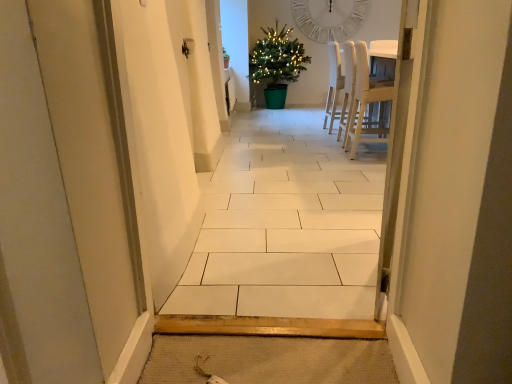
Question: From the image's perspective, is white wood chair at center, which is counted as the second chair, starting from the front, on top of white tile floor at center?

Choices:
 (A) no
 (B) yes

Answer: (B)

Question: Is white wood chair at center, which is counted as the second chair, starting from the front, thinner than white tile floor at center?

Choices:
 (A) no
 (B) yes

Answer: (A)

Question: Considering the relative positions of white wood chair at center, which is the first chair from back to front, and white tile floor at center in the image provided, is white wood chair at center, which is the first chair from back to front, behind white tile floor at center?

Choices:
 (A) yes
 (B) no

Answer: (A)

Question: Can you confirm if white wood chair at center, which is the first chair from back to front, is positioned to the left of white tile floor at center?

Choices:
 (A) no
 (B) yes

Answer: (A)

Question: From the image's perspective, is white wood chair at center, which is the first chair from back to front, below white tile floor at center?

Choices:
 (A) yes
 (B) no

Answer: (B)

Question: From a real-world perspective, is white wood chair at center, which is the first chair from back to front, on top of white tile floor at center?

Choices:
 (A) yes
 (B) no

Answer: (B)

Question: Considering the relative positions of white wood chair at center, which is the first chair from back to front, and white matte clock at upper center in the image provided, is white wood chair at center, which is the first chair from back to front, to the left of white matte clock at upper center from the viewer's perspective?

Choices:
 (A) yes
 (B) no

Answer: (A)

Question: Can you confirm if white wood chair at center, which is the first chair from back to front, is smaller than white matte clock at upper center?

Choices:
 (A) yes
 (B) no

Answer: (B)

Question: From a real-world perspective, does white wood chair at center, which is the first chair from back to front, stand above white matte clock at upper center?

Choices:
 (A) yes
 (B) no

Answer: (B)

Question: Does white wood chair at center, which is counted as the second chair, starting from the front, lie in front of white matte clock at upper center?

Choices:
 (A) no
 (B) yes

Answer: (B)

Question: Is white matte clock at upper center at the back of white wood chair at center, which is counted as the second chair, starting from the front?

Choices:
 (A) no
 (B) yes

Answer: (A)

Question: From the image's perspective, is white wood chair at center, which is the first chair from back to front, over white matte clock at upper center?

Choices:
 (A) yes
 (B) no

Answer: (B)

Question: Is white matte clock at upper center next to green plastic potted plant at center and touching it?

Choices:
 (A) yes
 (B) no

Answer: (B)